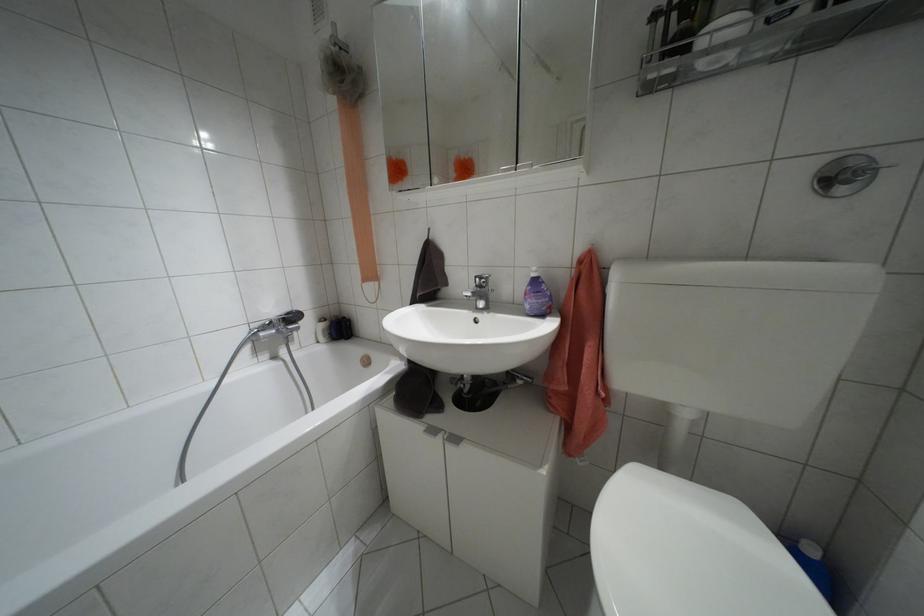
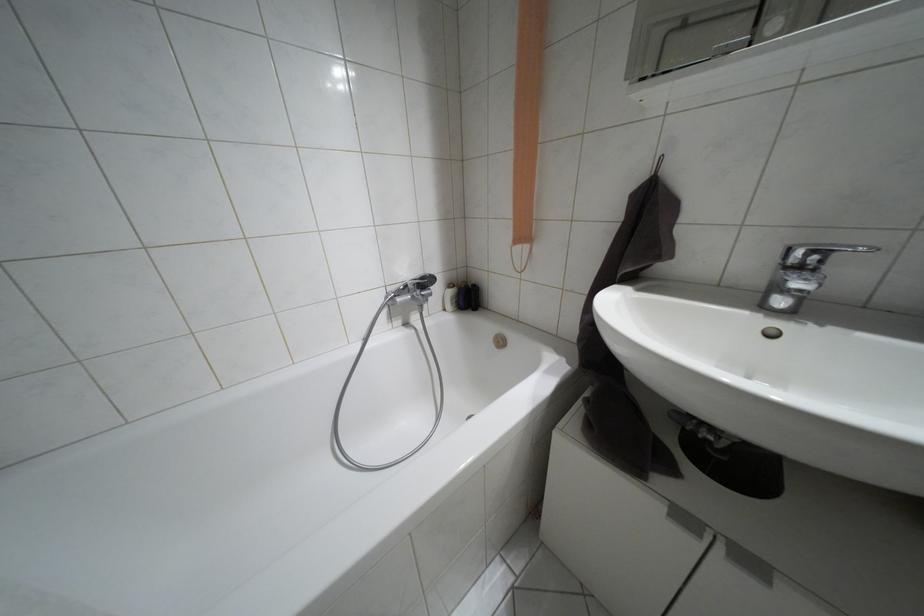
Which direction would the cameraman need to move to produce the second image?

The cameraman moved toward left, forward.